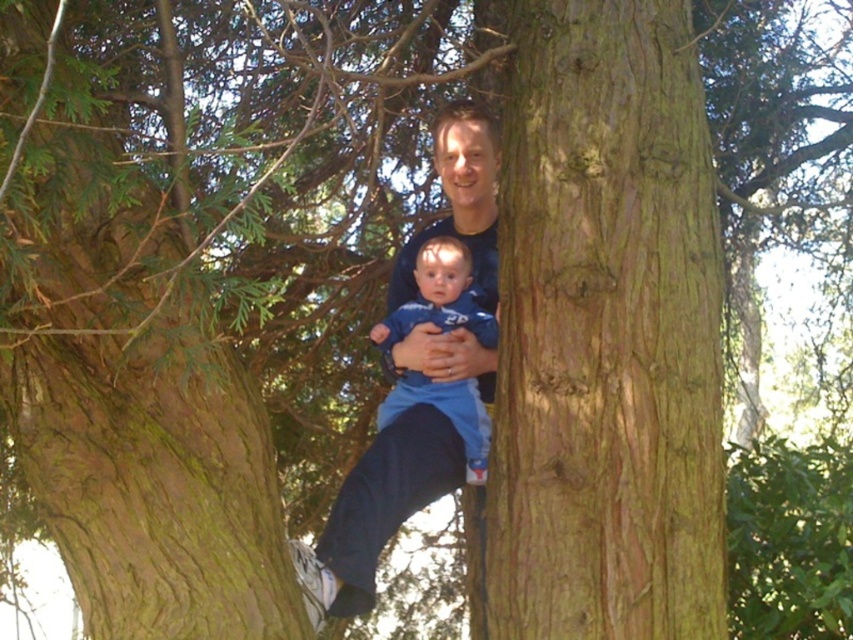
You are a photographer trying to capture a candid shot of the dark blue shirt at center and the blue soft fabric baby at center. Which one is positioned lower in the frame?

The dark blue shirt at center is located below the blue soft fabric baby at center, so the dark blue shirt at center is positioned lower in the frame.

Based on the coordinates provided, which object is located at point (x=376, y=509) in the image?

The point (x=376, y=509) corresponds to the dark blue shirt at center.